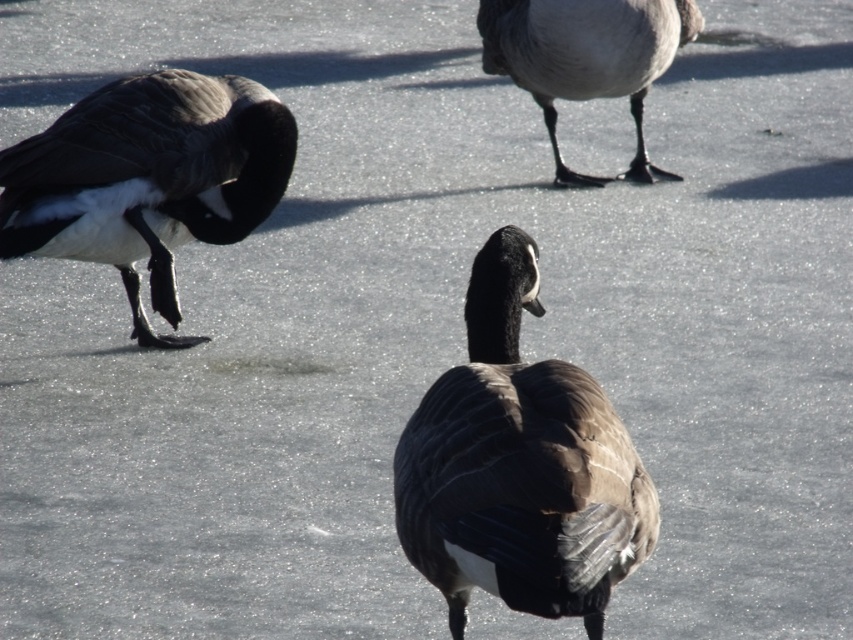
You are a wildlife photographer aiming to capture a closeup of the Canada geese in the scene. You need to adjust your camera to focus on the dark brown feathers at left located at point (148, 179). Since the geese are on ice, which is slippery, you must ensure your camera is steady. Where should you position your tripod legs to avoid slipping? Consider the ice texture described in the scene.

The dark brown feathers at left are located at point (148, 179). Since the ice has a smooth but textured surface with subtle variations in color and light reflecting off, positioning the tripod legs on areas of the ice with more texture and less reflection would provide better grip and stability. Look for spots with visible texture near the dark brown feathers at left to place the tripod securely.

You are a birdwatcher observing the Canada geese on the frozen pond. You notice the dark brown feathers at left and the gray matte duck feet at upper center. Which object is taller?

The dark brown feathers at left are taller than the gray matte duck feet at upper center.

You are a photographer aiming to capture a closeup of the brown textured goose at center and the gray matte duck feet at upper center. Based on their positions, which one will appear larger in your photo?

The brown textured goose at center will appear larger in the photo because it is closer to the viewer than the gray matte duck feet at upper center.